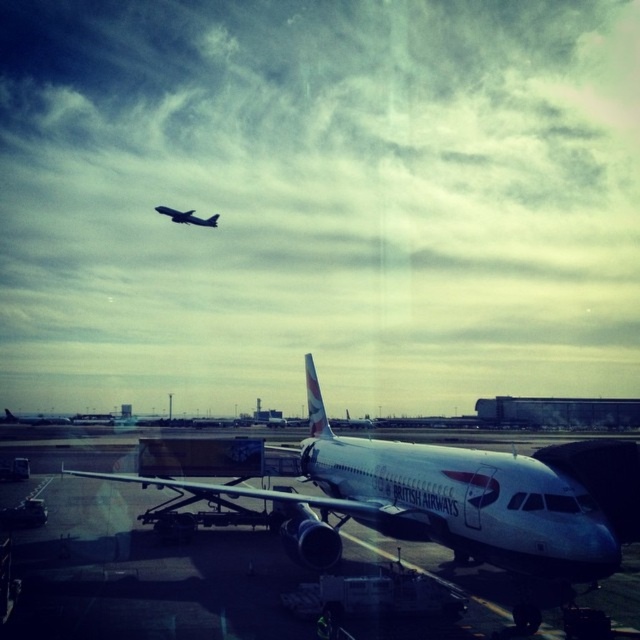
Question: Observing the image, what is the correct spatial positioning of silver metallic airplane at center in reference to metallic silver airplane at upper center?

Choices:
 (A) right
 (B) left

Answer: (A)

Question: Is silver metallic airplane at center wider than metallic silver airplane at upper center?

Choices:
 (A) yes
 (B) no

Answer: (A)

Question: Which point is farther to the camera?

Choices:
 (A) metallic silver airplane at upper center
 (B) silver metallic airplane at center

Answer: (A)

Question: Is silver metallic airplane at center further to the viewer compared to metallic silver airplane at upper center?

Choices:
 (A) no
 (B) yes

Answer: (A)

Question: Which point appears closest to the camera in this image?

Choices:
 (A) (554, 577)
 (B) (172, 220)

Answer: (A)